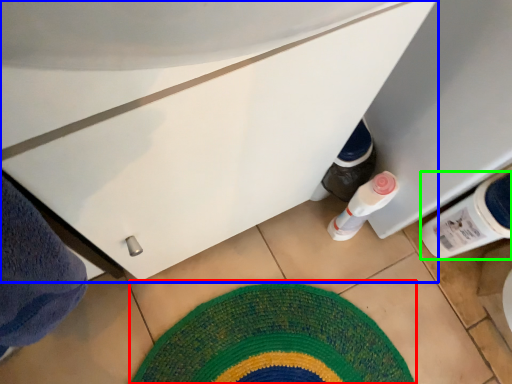
Question: Which object is positioned closest to mat (highlighted by a red box)? Select from cabinetry (highlighted by a blue box) and bottle (highlighted by a green box).

Choices:
 (A) cabinetry
 (B) bottle

Answer: (B)